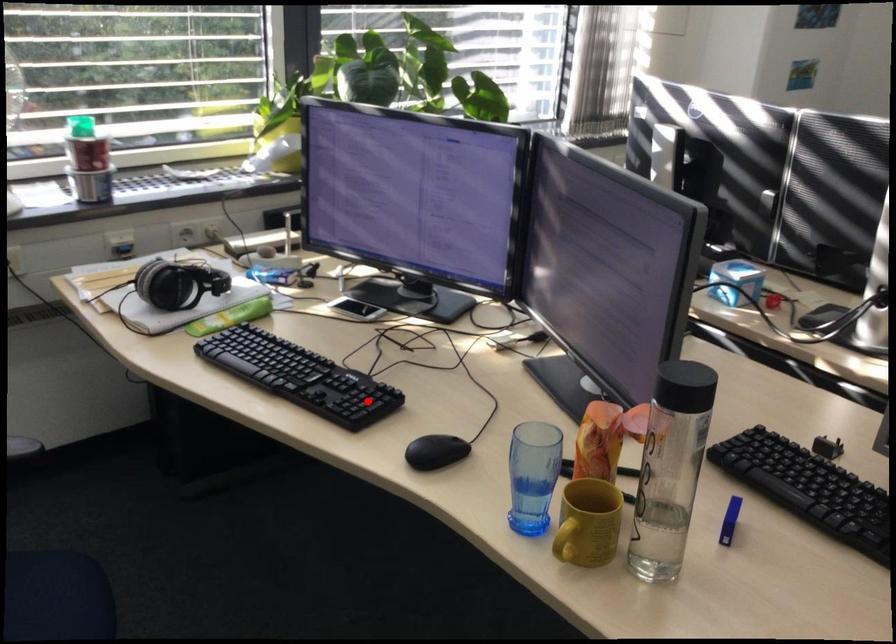
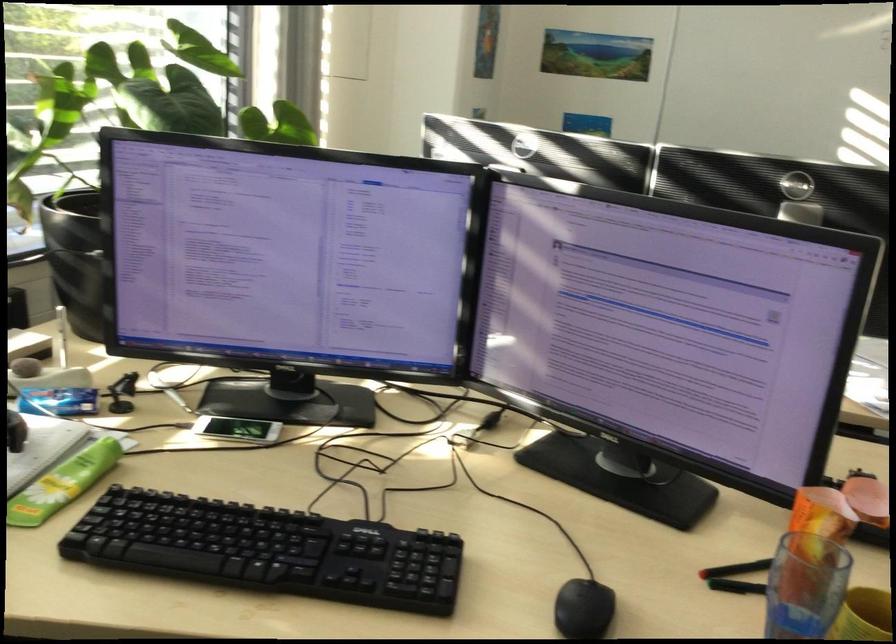
In the second image, find the point that corresponds to the highlighted location in the first image.

(424, 565)